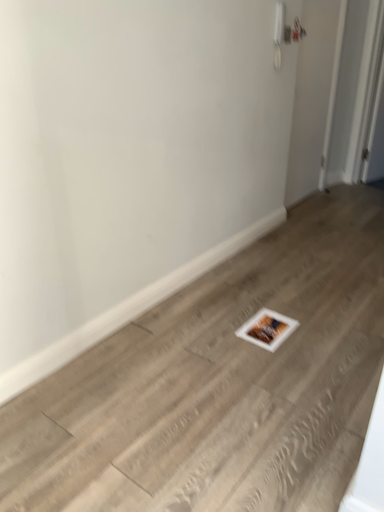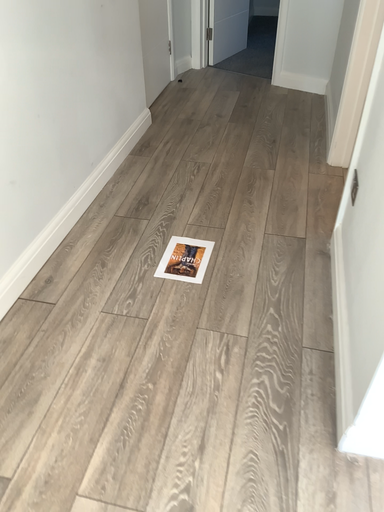
Question: How did the camera likely rotate when shooting the video?

Choices:
 (A) rotated right
 (B) rotated left

Answer: (A)